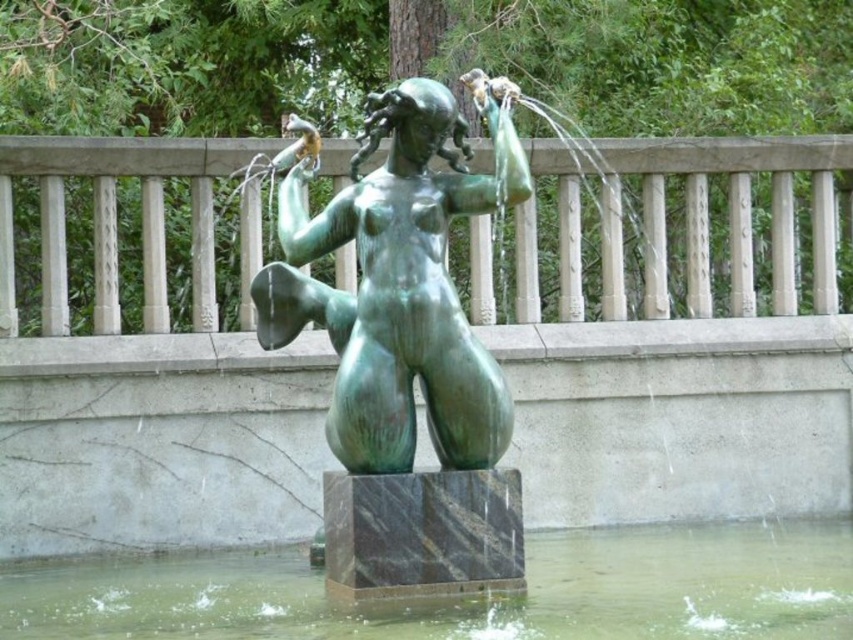
You are standing in front of the fountain and want to place a small decorative stone exactly at the center of the greenish water at base center. According to the coordinates provided, where should you place the stone?

The greenish water at base center is located at point (468,602), so you should place the stone at those coordinates to position it exactly at the center.

You are standing in front of the bronze sculpture and want to take a photo. You notice two points on the sculpture marked as point 1 at coordinates point (547, 532) and point 2 at coordinates point (413, 225). Which point is closer to your camera when taking the photo?

Point (413, 225) is closer to the camera because it is not as far as point (547, 532) which is further away.

You are standing in front of the fountain and want to know where the greenish water at base center is in relation to the green patina statue at center. Can you tell me its position?

The greenish water at base center is located below the green patina statue at center.